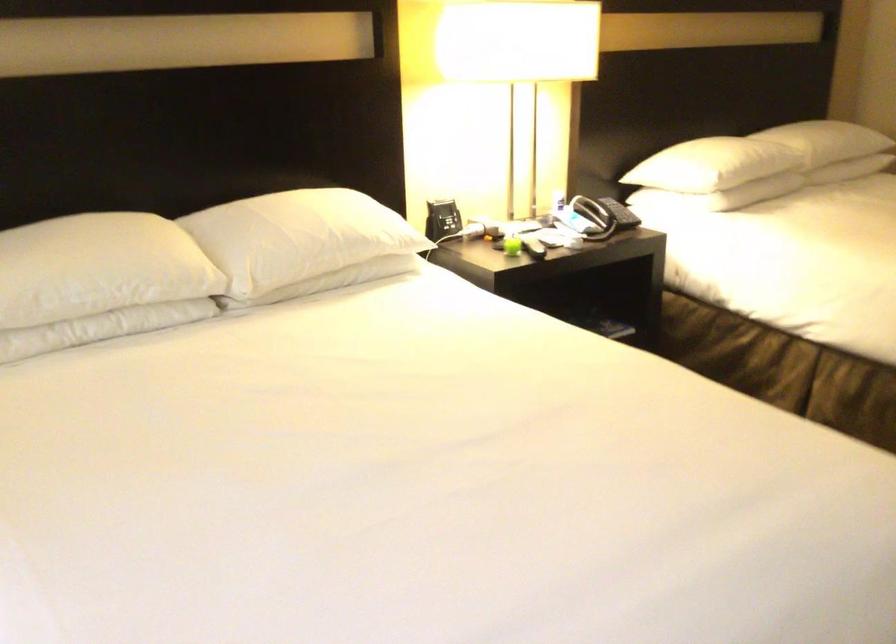
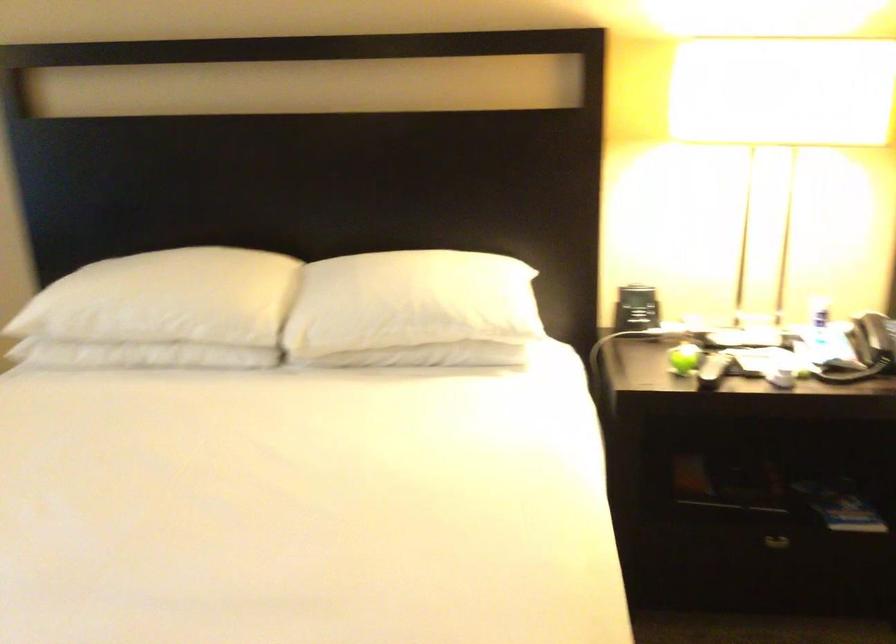
Find the pixel in the second image that matches (517,243) in the first image.

(684, 359)